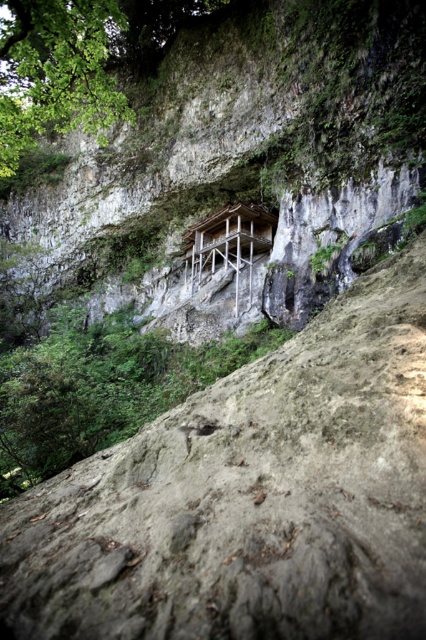
Question: Which object is closer to the camera taking this photo?

Choices:
 (A) green leafy tree at upper left
 (B) wooden platform at center

Answer: (A)

Question: Can you confirm if green leafy tree at upper left is positioned to the left of wooden platform at center?

Choices:
 (A) yes
 (B) no

Answer: (A)

Question: Does green leafy tree at upper left have a larger size compared to wooden platform at center?

Choices:
 (A) yes
 (B) no

Answer: (A)

Question: Among these points, which one is farthest from the camera?

Choices:
 (A) (249, 216)
 (B) (54, 90)

Answer: (A)

Question: Is green leafy tree at upper left above wooden platform at center?

Choices:
 (A) yes
 (B) no

Answer: (A)